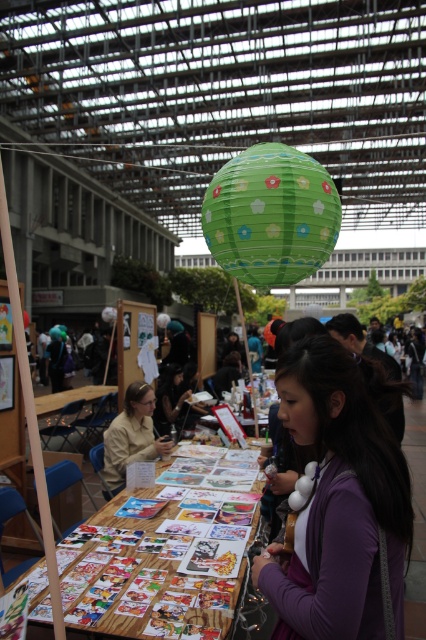
Question: Does purple matte jacket at center appear on the right side of printed paper cards at center?

Choices:
 (A) yes
 (B) no

Answer: (A)

Question: Which of the following is the closest to the observer?

Choices:
 (A) (210, 230)
 (B) (114, 465)
 (C) (307, 428)
 (D) (81, 602)

Answer: (C)

Question: Can you confirm if purple matte jacket at center is wider than green paper lantern at center?

Choices:
 (A) yes
 (B) no

Answer: (B)

Question: Estimate the real-world distances between objects in this image. Which object is farther from the green paper lantern at center?

Choices:
 (A) printed paper cards at center
 (B) purple matte jacket at center
 (C) matte beige shirt at center

Answer: (C)

Question: Is printed paper cards at center wider than green paper lantern at center?

Choices:
 (A) no
 (B) yes

Answer: (B)

Question: Which object is positioned closest to the matte beige shirt at center?

Choices:
 (A) green paper lantern at center
 (B) purple matte jacket at center

Answer: (A)